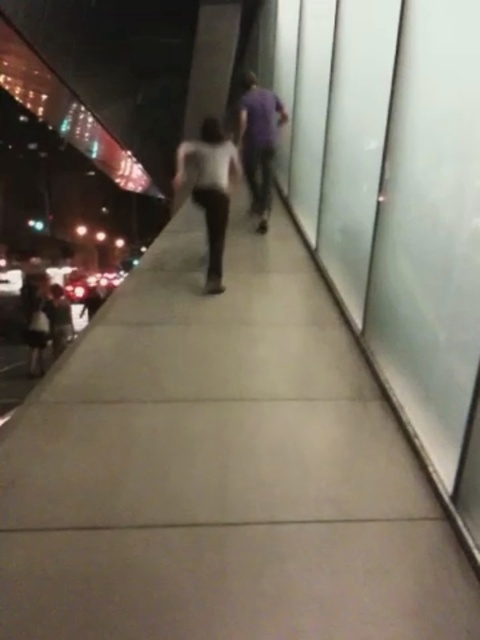
Question: In this image, where is white matte shirt at center located relative to purple matte shirt at center?

Choices:
 (A) above
 (B) below

Answer: (B)

Question: Which is nearer to the purple matte shirt at center?

Choices:
 (A) white matte shirt at center
 (B) gray concrete pavement at center

Answer: (A)

Question: Is white matte shirt at center smaller than purple matte shirt at center?

Choices:
 (A) no
 (B) yes

Answer: (B)

Question: Which point appears closest to the camera in this image?

Choices:
 (A) (370, 612)
 (B) (201, 184)

Answer: (A)

Question: Is gray concrete pavement at center positioned behind white matte shirt at center?

Choices:
 (A) yes
 (B) no

Answer: (B)

Question: Which object is positioned closest to the gray concrete pavement at center?

Choices:
 (A) purple matte shirt at center
 (B) white matte shirt at center

Answer: (B)